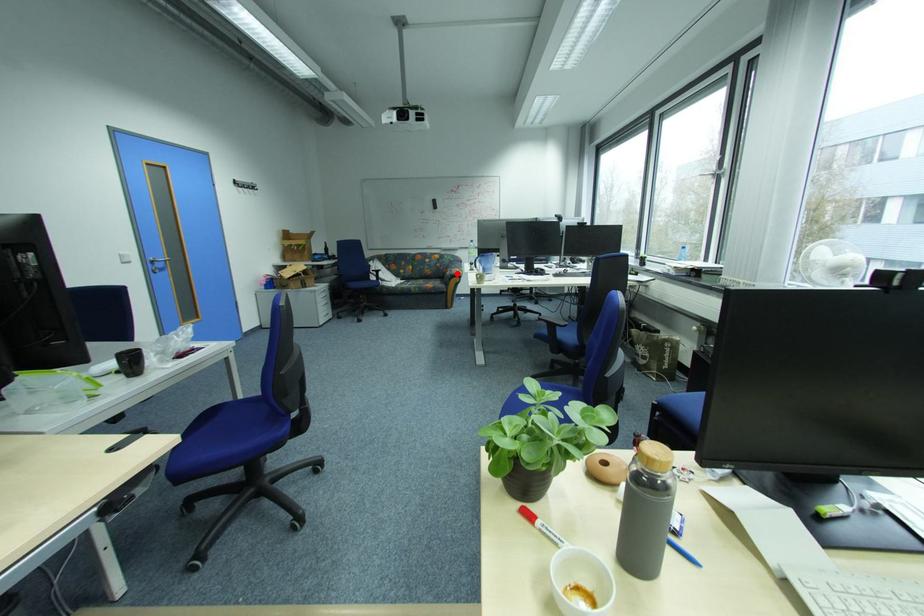
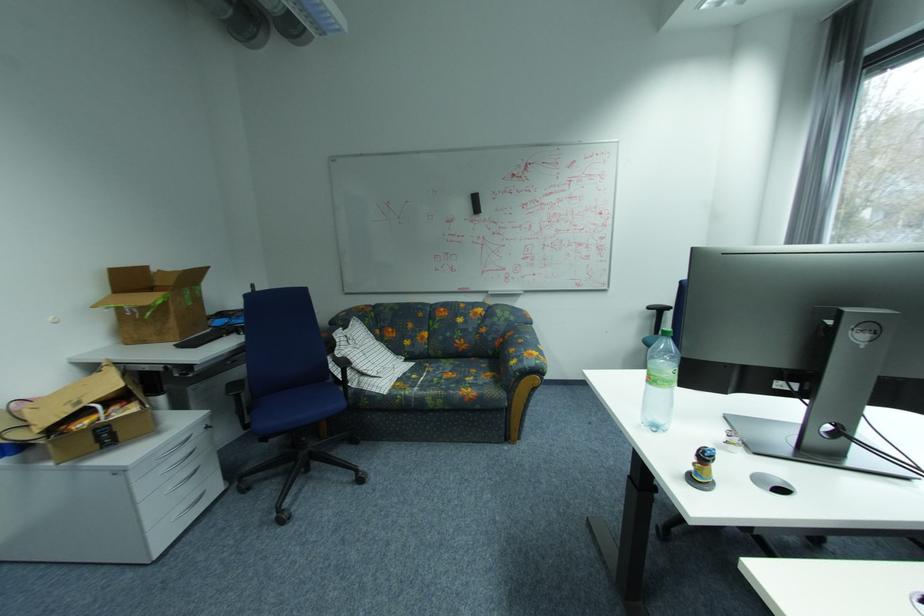
Question: I am providing you with two images of the same scene from different viewpoints. A red point is shown in image1. For the corresponding object point in image2, is it positioned nearer or farther from the camera?

Choices:
 (A) Nearer
 (B) Farther

Answer: (B)